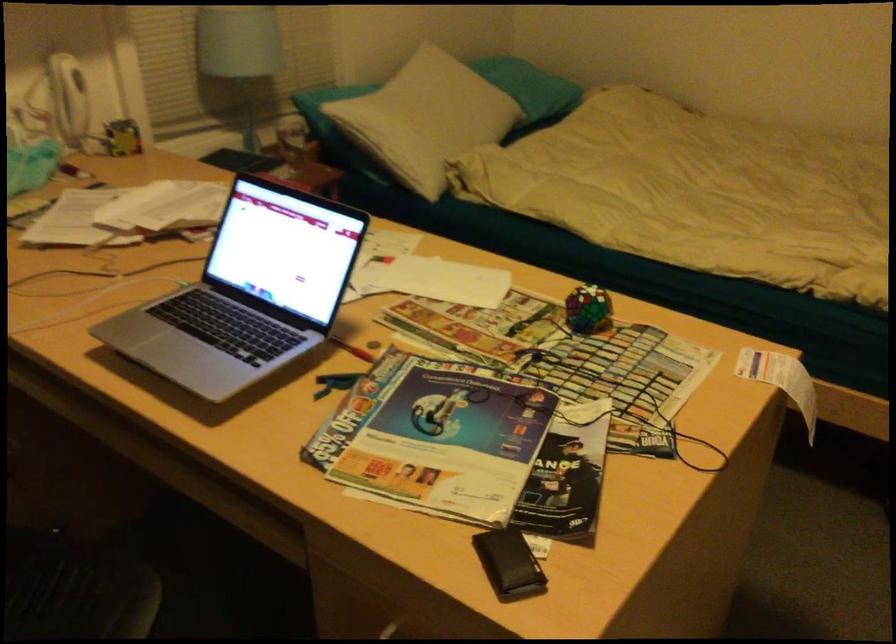
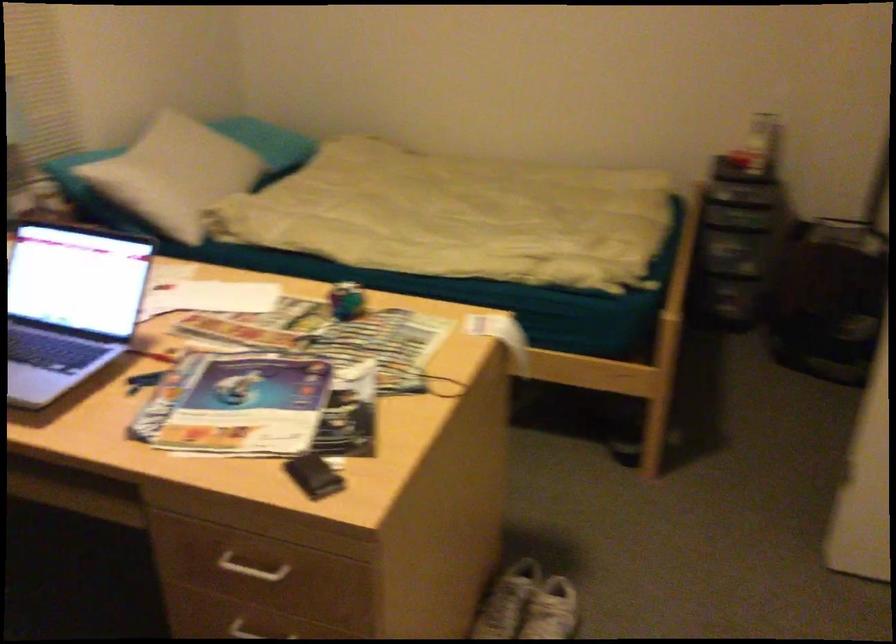
Question: What movement of the cameraman would produce the second image?

Choices:
 (A) Left
 (B) Right
 (C) Forward
 (D) Backward

Answer: (D)